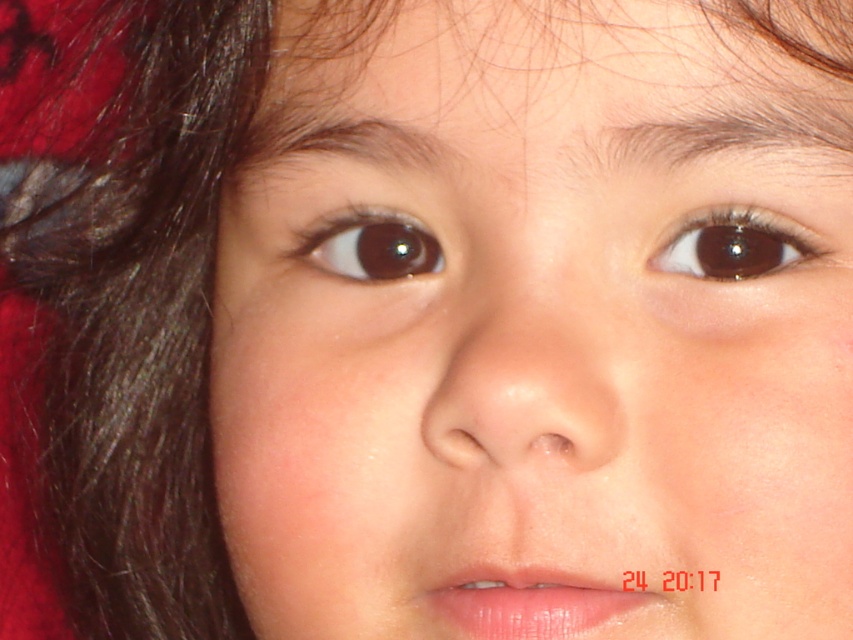
Looking at the child in the image, which object is located above the other between the smooth skin nose at center and the dark brown hair at upper center?

The dark brown hair at upper center is above the smooth skin nose at center.

Looking at the child in the image, which part of their face takes up more vertical space between the smooth skin at upper center and the smooth skin nose at center?

The smooth skin at upper center takes up more vertical space than the smooth skin nose at center because it is much taller.